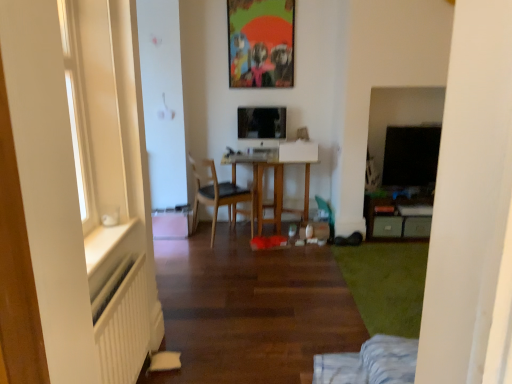
Question: Can you confirm if wooden table at center is positioned to the left of wooden chair at center?

Choices:
 (A) yes
 (B) no

Answer: (B)

Question: From the image's perspective, would you say wooden table at center is shown under wooden chair at center?

Choices:
 (A) yes
 (B) no

Answer: (B)

Question: Does wooden table at center touch wooden chair at center?

Choices:
 (A) no
 (B) yes

Answer: (A)

Question: Is the position of wooden table at center more distant than that of wooden chair at center?

Choices:
 (A) yes
 (B) no

Answer: (A)

Question: Would you consider wooden table at center to be distant from wooden chair at center?

Choices:
 (A) no
 (B) yes

Answer: (A)

Question: From the image's perspective, would you say wooden table at center is positioned over wooden chair at center?

Choices:
 (A) no
 (B) yes

Answer: (B)

Question: From the image's perspective, is matte plastic picture frame at upper center located above white ribbed radiator at lower left?

Choices:
 (A) no
 (B) yes

Answer: (B)

Question: Can you confirm if matte plastic picture frame at upper center is taller than white ribbed radiator at lower left?

Choices:
 (A) no
 (B) yes

Answer: (B)

Question: Is white ribbed radiator at lower left completely or partially inside matte plastic picture frame at upper center?

Choices:
 (A) no
 (B) yes

Answer: (A)

Question: Is the depth of matte plastic picture frame at upper center greater than that of white ribbed radiator at lower left?

Choices:
 (A) no
 (B) yes

Answer: (B)

Question: Is matte plastic picture frame at upper center thinner than white ribbed radiator at lower left?

Choices:
 (A) yes
 (B) no

Answer: (A)

Question: From a real-world perspective, is matte plastic picture frame at upper center physically above white ribbed radiator at lower left?

Choices:
 (A) no
 (B) yes

Answer: (B)

Question: From the image's perspective, is wooden chair at center beneath wooden table at center?

Choices:
 (A) yes
 (B) no

Answer: (A)